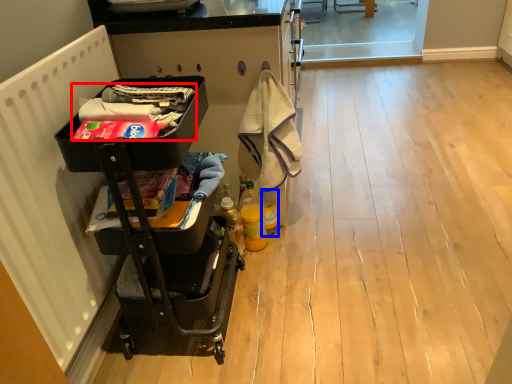
Question: Which of the following is the closest to the observer, laundry (highlighted by a red box) or bottle (highlighted by a blue box)?

Choices:
 (A) laundry
 (B) bottle

Answer: (A)